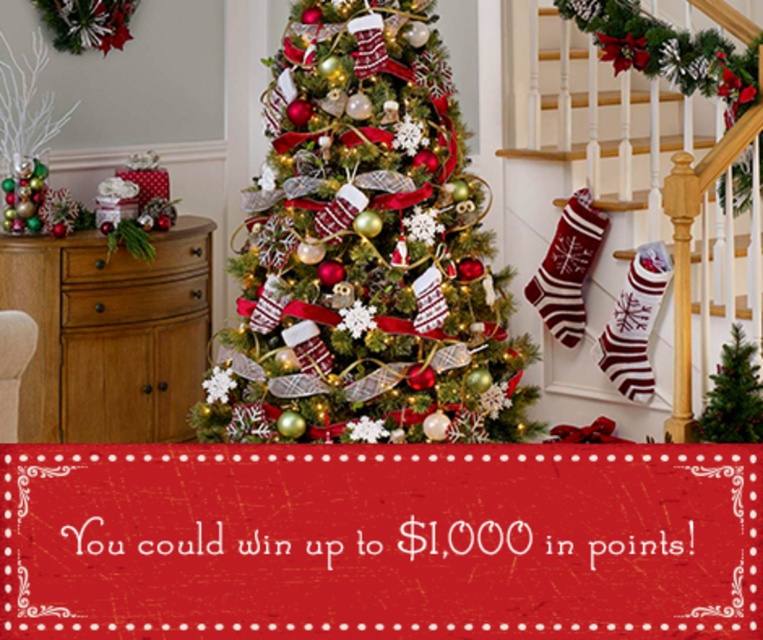
Between matte red sign at center and shiny green christmas tree at center, which one is positioned higher?

shiny green christmas tree at center is higher up.

This screenshot has width=763, height=640. I want to click on matte red sign at center, so click(380, 540).

Does point (604, 618) come farther from viewer compared to point (456, 236)?

No, (604, 618) is in front of (456, 236).

Identify the location of matte red sign at center. click(380, 540).

Does matte red sign at center appear on the right side of knit stockings at center?

Incorrect, matte red sign at center is not on the right side of knit stockings at center.

Who is lower down, matte red sign at center or knit stockings at center?

matte red sign at center

Is point (581, 628) in front of point (687, 241)?

Yes, point (581, 628) is closer to viewer.

Identify the location of matte red sign at center. This screenshot has height=640, width=763. 380,540.

From the picture: Which of these two, knit stockings at center or green matte christmas tree at center, stands taller?

Standing taller between the two is knit stockings at center.

Does point (655, 86) come farther from viewer compared to point (723, 413)?

Yes, it is behind point (723, 413).

Which is in front, point (713, 205) or point (720, 381)?

Point (720, 381) is in front.

I want to click on knit stockings at center, so click(x=626, y=211).